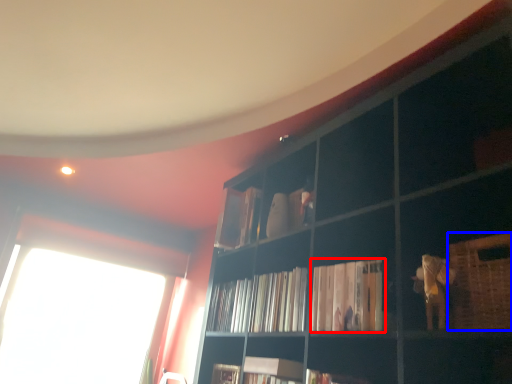
Question: Among these objects, which one is farthest to the camera, book (highlighted by a red box) or basket (highlighted by a blue box)?

Choices:
 (A) book
 (B) basket

Answer: (A)